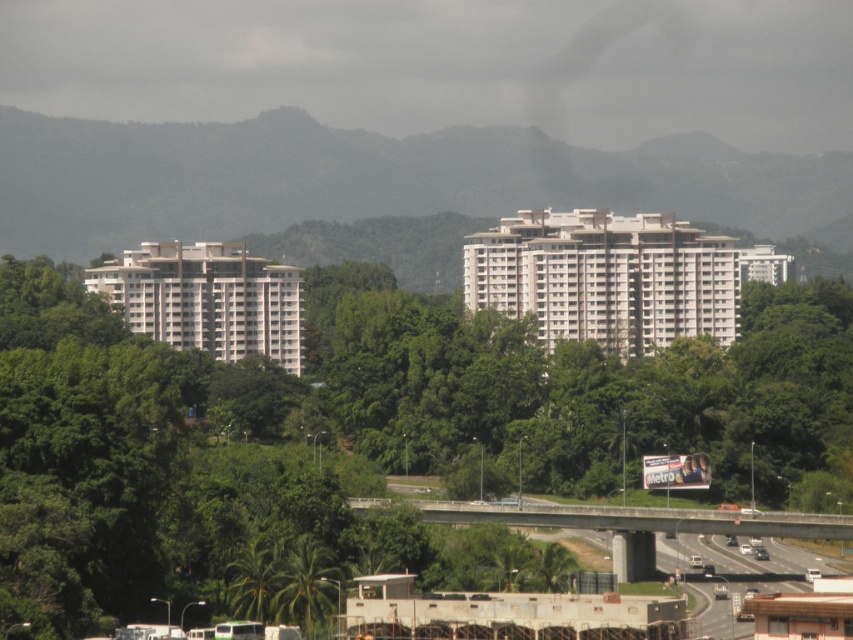
Question: Does gray/cloudy sky at upper center appear on the left side of concrete highway at lower center?

Choices:
 (A) yes
 (B) no

Answer: (A)

Question: Considering the relative positions of green leafy tree at center and concrete highway at lower center in the image provided, where is green leafy tree at center located with respect to concrete highway at lower center?

Choices:
 (A) below
 (B) above

Answer: (B)

Question: Where is gray/cloudy sky at upper center located in relation to concrete highway at lower center in the image?

Choices:
 (A) left
 (B) right

Answer: (A)

Question: Which point is closer to the camera?

Choices:
 (A) (363, 502)
 (B) (190, 36)

Answer: (A)

Question: Estimate the real-world distances between objects in this image. Which object is closer to the gray/cloudy sky at upper center?

Choices:
 (A) green leafy tree at center
 (B) concrete highway at lower center

Answer: (A)

Question: Which object is positioned farthest from the gray/cloudy sky at upper center?

Choices:
 (A) green leafy tree at center
 (B) concrete highway at lower center

Answer: (B)